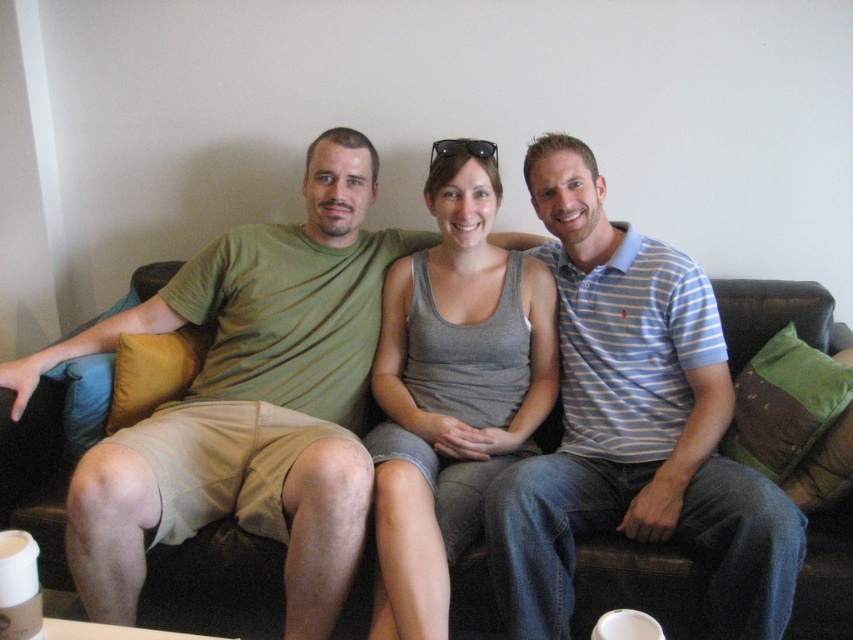
Is blue striped polo shirt at center to the left of gray tank top at center from the viewer's perspective?

Incorrect, blue striped polo shirt at center is not on the left side of gray tank top at center.

Is point (740, 612) positioned behind point (436, 625)?

Yes.

You are a GUI agent. You are given a task and a screenshot of the screen. Output one action in this format:
    pyautogui.click(x=<x>, y=<y>)
    Task: Click on the blue striped polo shirt at center
    
    Given the screenshot: What is the action you would take?
    pyautogui.click(x=634, y=426)

Does gray tank top at center have a greater width compared to brown leather couch at center?

Incorrect, gray tank top at center's width does not surpass brown leather couch at center's.

Does gray tank top at center lie in front of brown leather couch at center?

That is True.

Find the location of a particular element. This screenshot has height=640, width=853. gray tank top at center is located at coordinates (451, 388).

The width and height of the screenshot is (853, 640). Find the location of `gray tank top at center`. gray tank top at center is located at coordinates tap(451, 388).

Can you confirm if blue striped polo shirt at center is smaller than brown leather couch at center?

Yes, blue striped polo shirt at center is smaller than brown leather couch at center.

What do you see at coordinates (634, 426) in the screenshot? This screenshot has width=853, height=640. I see `blue striped polo shirt at center` at bounding box center [634, 426].

Where is `blue striped polo shirt at center`? blue striped polo shirt at center is located at coordinates (634, 426).